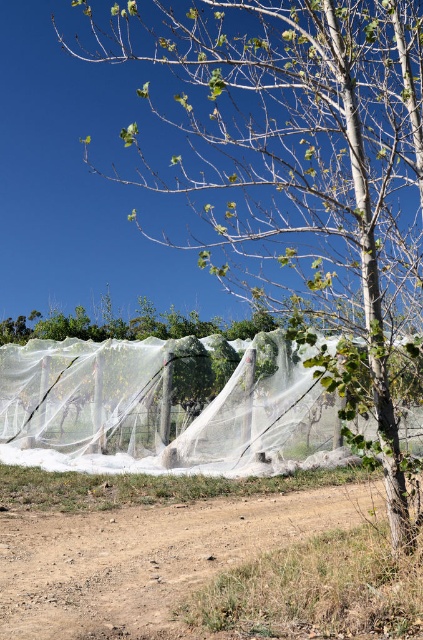
You are standing at the origin point of the image coordinate system. You want to walk to the brown dirt field at lower center. What are the coordinates you need to reach?

The coordinates to reach the brown dirt field at lower center are at point [209,570].

You are a farmer checking the field. You need to know if the brown dirt field at lower center can fit entirely under the transparent nylon net at center. Can it?

The brown dirt field at lower center is narrower than the transparent nylon net at center, so it can fit entirely under the net.

You are a farmer planning to plant crops in the brown dirt field at lower center. You notice the transparent nylon net at center nearby. Which area has a larger surface area for planting?

The transparent nylon net at center has a larger surface area than the brown dirt field at lower center, so planting under the transparent nylon net at center would allow for more crops to be planted.